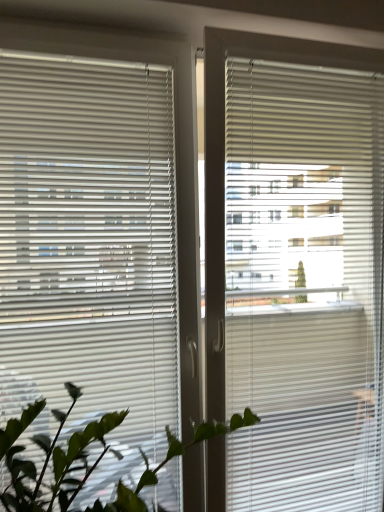
The image size is (384, 512). I want to click on white plastic blinds at left, so [90, 249].

Describe the element at coordinates (90, 249) in the screenshot. The height and width of the screenshot is (512, 384). I see `white plastic blinds at left` at that location.

Find the location of a particular element. The image size is (384, 512). white plastic blinds at left is located at coordinates (90, 249).